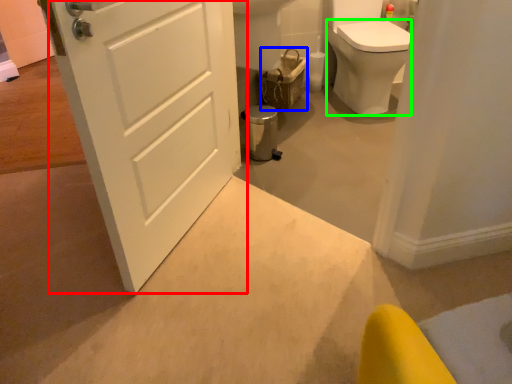
Question: Considering the real-world distances, which object is closest to door (highlighted by a red box)? basket (highlighted by a blue box) or bidet (highlighted by a green box).

Choices:
 (A) basket
 (B) bidet

Answer: (A)